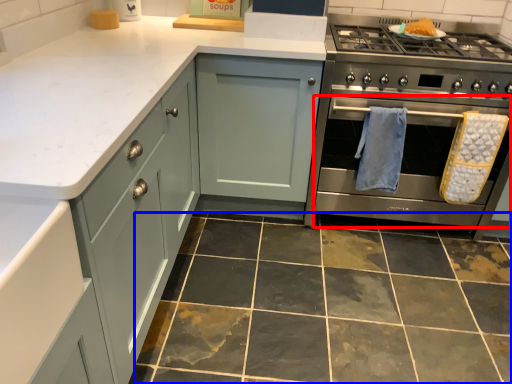
Question: Which object appears closest to the camera in this image, oven (highlighted by a red box) or ceramic tile (highlighted by a blue box)?

Choices:
 (A) oven
 (B) ceramic tile

Answer: (B)